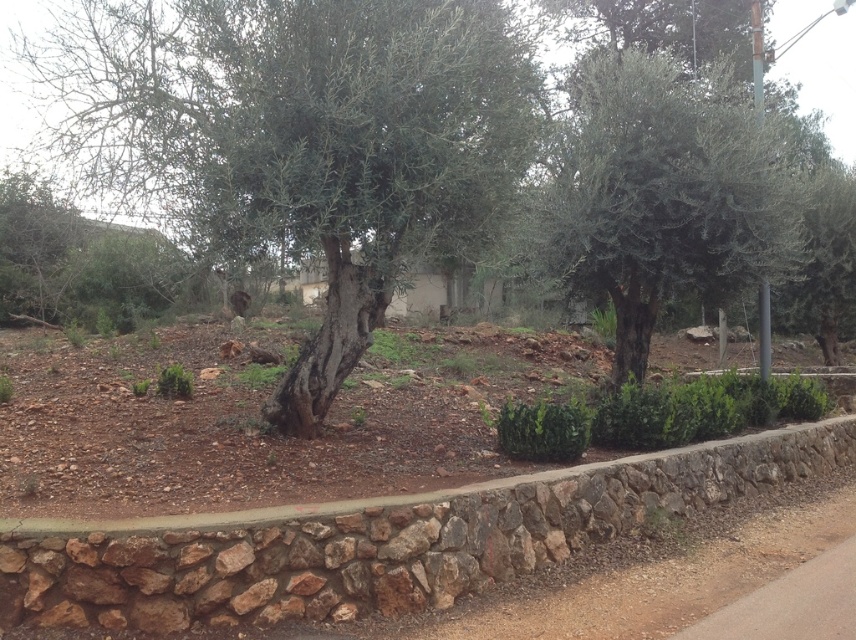
Question: Does green rough bark tree at center appear under green leafy olive tree at center?

Choices:
 (A) yes
 (B) no

Answer: (B)

Question: Which point appears closest to the camera in this image?

Choices:
 (A) (366, 182)
 (B) (557, 212)

Answer: (A)

Question: Among these objects, which one is farthest from the camera?

Choices:
 (A) green rough bark tree at center
 (B) green leafy olive tree at center

Answer: (B)

Question: Which object appears farthest from the camera in this image?

Choices:
 (A) green rough bark tree at center
 (B) green leafy olive tree at center

Answer: (B)

Question: Is green rough bark tree at center above green leafy olive tree at center?

Choices:
 (A) no
 (B) yes

Answer: (B)

Question: Can you confirm if green rough bark tree at center is thinner than green leafy olive tree at center?

Choices:
 (A) no
 (B) yes

Answer: (A)